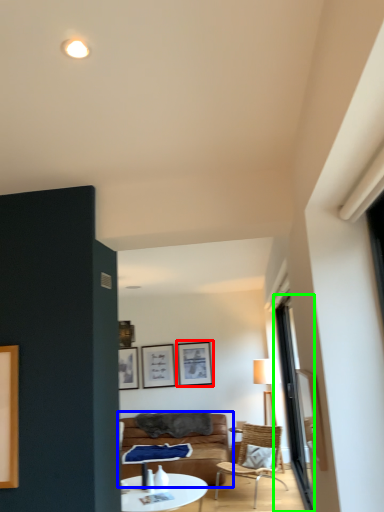
Question: Estimate the real-world distances between objects in this image. Which object is farther from picture frame (highlighted by a red box), studio couch (highlighted by a blue box) or window (highlighted by a green box)?

Choices:
 (A) studio couch
 (B) window

Answer: (B)